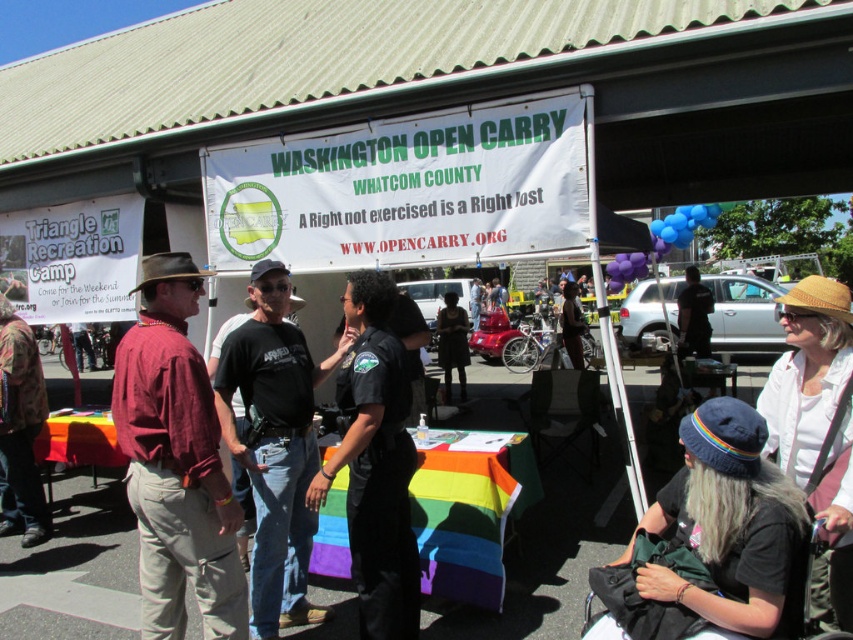
Question: Which point is farther from the camera taking this photo?

Choices:
 (A) (355, 557)
 (B) (310, 369)

Answer: (B)

Question: Which object is positioned farthest from the black cotton t-shirt at center?

Choices:
 (A) black uniform at center
 (B) maroon linen shirt at center

Answer: (B)

Question: Which point is closer to the camera taking this photo?

Choices:
 (A) (258, 288)
 (B) (202, 636)

Answer: (A)

Question: Does black cotton t-shirt at center appear over black uniform at center?

Choices:
 (A) yes
 (B) no

Answer: (B)

Question: Observing the image, what is the correct spatial positioning of maroon linen shirt at center in reference to black uniform at center?

Choices:
 (A) right
 (B) left

Answer: (B)

Question: Can you confirm if maroon linen shirt at center is positioned to the right of black uniform at center?

Choices:
 (A) yes
 (B) no

Answer: (B)